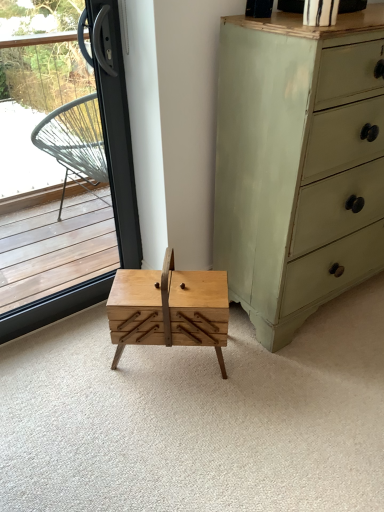
Locate an element on the screen. The image size is (384, 512). unoccupied area in front of natural wood table at center is located at coordinates (174, 417).